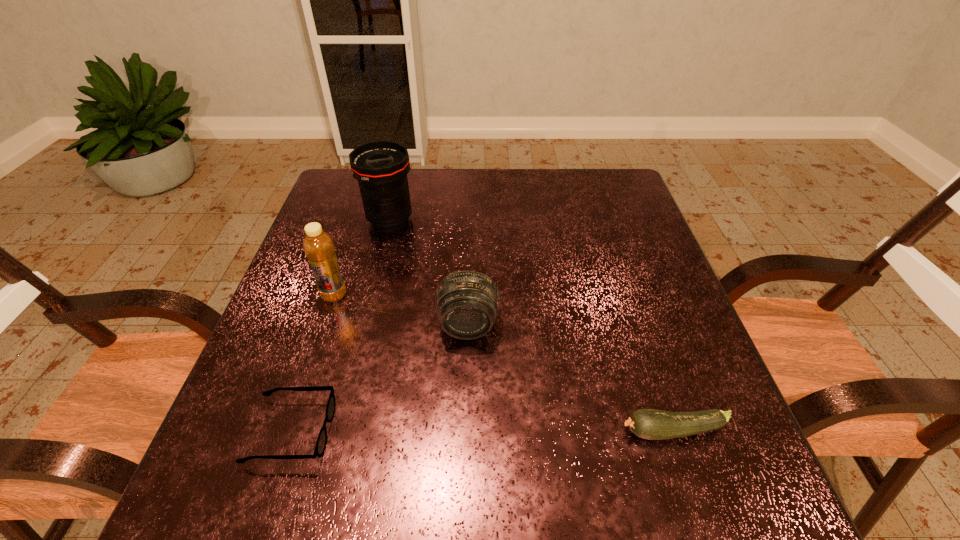
This screenshot has width=960, height=540. I want to click on object located at the far left corner, so click(x=381, y=167).

Find the location of a particular element. Image resolution: width=960 pixels, height=540 pixels. object located in the near left corner section of the desktop is located at coordinates (320, 447).

Image resolution: width=960 pixels, height=540 pixels. In the image, there is a desktop. In order to click on vacant space at the far edge in this screenshot , I will do `click(541, 203)`.

I want to click on free region at the near edge, so click(565, 500).

The width and height of the screenshot is (960, 540). I want to click on vacant space at the left edge of the desktop, so click(255, 418).

Identify the location of vacant space at the right edge. This screenshot has width=960, height=540. (629, 250).

The width and height of the screenshot is (960, 540). In the image, there is a desktop. In order to click on vacant space at the far left corner in this screenshot , I will do `click(348, 178)`.

In the image, there is a desktop. Identify the location of vacant space at the far right corner. This screenshot has width=960, height=540. (621, 190).

You are a GUI agent. You are given a task and a screenshot of the screen. Output one action in this format:
    pyautogui.click(x=<x>, y=<y>)
    Task: Click on the vacant point at the near right corner
    The image size is (960, 540).
    Given the screenshot: What is the action you would take?
    pyautogui.click(x=671, y=489)

Where is `empty space between the farther telephoto lens and the shortest object`? This screenshot has width=960, height=540. empty space between the farther telephoto lens and the shortest object is located at coordinates (341, 326).